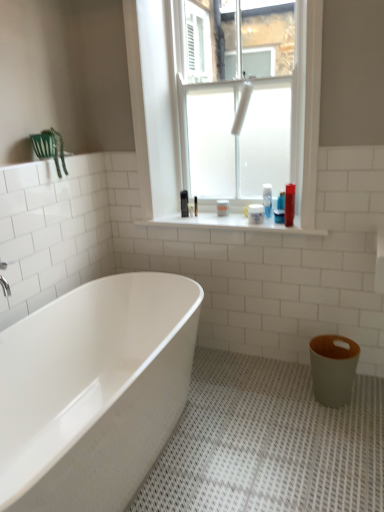
Question: Should I look upward or downward to see frosted glass window at upper center?

Choices:
 (A) down
 (B) up

Answer: (B)

Question: From a real-world perspective, is white glossy shelf at center positioned over white glossy bathtub at lower left based on gravity?

Choices:
 (A) yes
 (B) no

Answer: (A)

Question: Is white glossy shelf at center at the right side of white glossy bathtub at lower left?

Choices:
 (A) yes
 (B) no

Answer: (A)

Question: Can you confirm if white glossy shelf at center is positioned to the left of white glossy bathtub at lower left?

Choices:
 (A) yes
 (B) no

Answer: (B)

Question: Is white glossy shelf at center in front of white glossy bathtub at lower left?

Choices:
 (A) no
 (B) yes

Answer: (A)

Question: Does white glossy shelf at center have a smaller size compared to white glossy bathtub at lower left?

Choices:
 (A) yes
 (B) no

Answer: (A)

Question: Can you confirm if white glossy shelf at center is wider than white glossy bathtub at lower left?

Choices:
 (A) yes
 (B) no

Answer: (B)

Question: Considering the relative positions of white matte container at upper center, which is the second toiletry in front-to-back order, and translucent plastic container at center, which is counted as the first toiletry, starting from the left, in the image provided, is white matte container at upper center, which is the second toiletry in front-to-back order, to the left of translucent plastic container at center, which is counted as the first toiletry, starting from the left, from the viewer's perspective?

Choices:
 (A) no
 (B) yes

Answer: (A)

Question: Is the position of white matte container at upper center, which is counted as the 3th toiletry, starting from the right, more distant than that of translucent plastic container at center, which is counted as the first toiletry, starting from the left?

Choices:
 (A) no
 (B) yes

Answer: (A)

Question: Could you tell me if white matte container at upper center, arranged as the third toiletry when viewed from the back, is turned towards translucent plastic container at center, the fourth toiletry when ordered from front to back?

Choices:
 (A) no
 (B) yes

Answer: (A)

Question: Can you confirm if white matte container at upper center, which is counted as the 3th toiletry, starting from the right, is shorter than translucent plastic container at center, which is the fourth toiletry from right to left?

Choices:
 (A) no
 (B) yes

Answer: (B)

Question: Considering the relative sizes of white matte container at upper center, arranged as the third toiletry when viewed from the back, and translucent plastic container at center, which is the fourth toiletry from right to left, in the image provided, is white matte container at upper center, arranged as the third toiletry when viewed from the back, smaller than translucent plastic container at center, which is the fourth toiletry from right to left,?

Choices:
 (A) no
 (B) yes

Answer: (B)

Question: Considering the relative sizes of white matte container at upper center, which is the second toiletry in front-to-back order, and translucent plastic container at center, the fourth toiletry when ordered from front to back, in the image provided, is white matte container at upper center, which is the second toiletry in front-to-back order, wider than translucent plastic container at center, the fourth toiletry when ordered from front to back,?

Choices:
 (A) no
 (B) yes

Answer: (B)

Question: Is matte plastic bottle at upper right, the 1th toiletry when ordered from right to left, wider than translucent plastic container at center, which is the fourth toiletry from right to left?

Choices:
 (A) yes
 (B) no

Answer: (B)